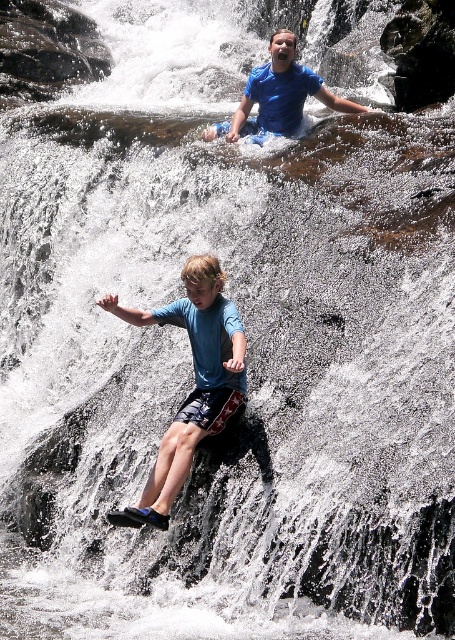
Is point (192, 348) behind point (301, 106)?

No, it is in front of (301, 106).

Is blue fabric shorts at center positioned in front of blue cotton shirt at upper center?

Yes, blue fabric shorts at center is in front of blue cotton shirt at upper center.

Does point (151, 476) come closer to viewer compared to point (251, 97)?

Yes, it is in front of point (251, 97).

You are a GUI agent. You are given a task and a screenshot of the screen. Output one action in this format:
    pyautogui.click(x=<x>, y=<y>)
    Task: Click on the blue fabric shorts at center
    
    Given the screenshot: What is the action you would take?
    pyautogui.click(x=195, y=381)